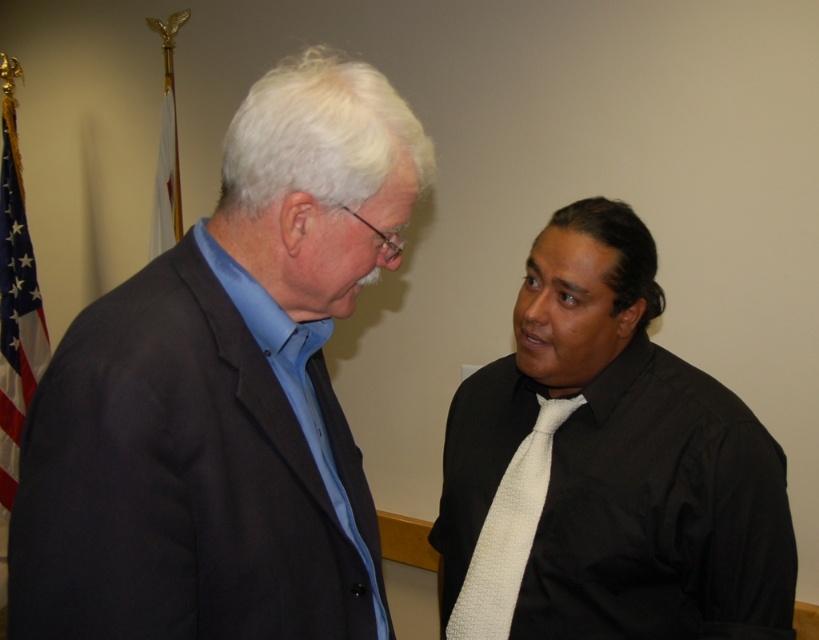
Looking at this image, you are a photographer trying to capture a portrait of the two people in the scene. The matte black suit at left and the white fabric flag at upper left are in your viewfinder. To ensure the flag doesn not distract from the subjects, which object should you focus on and why?

You should focus on the matte black suit at left because it is positioned under the white fabric flag at upper left, making it closer to the subjects and less likely to distract when focused on the suit.

You are a photographer trying to capture both the matte black suit at left and the american flag at left in a single frame. Given that your camera can only focus on objects within a 1.5 meter width, will you be able to fit both into the frame?

The matte black suit at left is bigger than the american flag at left, but since both are on the left side of the frame, their combined width may still fit within the 1.5 meter limit. However, without knowing the exact dimensions of each object, it is impossible to determine definitively.

You are standing at the origin of the coordinate system in the image. There is a point at coordinate (225, 394). What object is located at that point?

The object at point (225, 394) is the matte black suit at left.